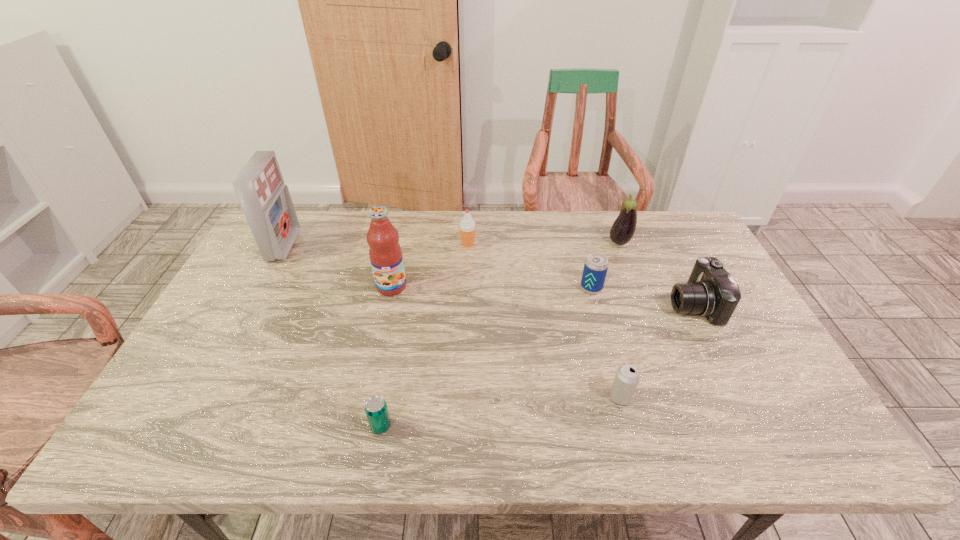
You are a GUI agent. You are given a task and a screenshot of the screen. Output one action in this format:
    pyautogui.click(x=<x>, y=<y>)
    Task: Click on the vacant space that satisfies the following two spatial constraints: 1. on the front side of the icecream; 2. on the right side of the second nearest object
    The width and height of the screenshot is (960, 540).
    Given the screenshot: What is the action you would take?
    pyautogui.click(x=463, y=397)

I want to click on vacant position in the image that satisfies the following two spatial constraints: 1. on the back side of the second nearest beer can; 2. on the right side of the eggplant, so click(578, 242).

Locate an element on the screen. Image resolution: width=960 pixels, height=540 pixels. vacant position in the image that satisfies the following two spatial constraints: 1. on the front label of the fruit juice; 2. on the right side of the farthest beer can is located at coordinates (391, 288).

Where is `free space that satisfies the following two spatial constraints: 1. on the back side of the farthest beer can; 2. on the right side of the sixth shortest object`? The height and width of the screenshot is (540, 960). free space that satisfies the following two spatial constraints: 1. on the back side of the farthest beer can; 2. on the right side of the sixth shortest object is located at coordinates (579, 242).

In order to click on blank area in the image that satisfies the following two spatial constraints: 1. on the front-facing side of the second nearest object; 2. on the right side of the leftmost object in this screenshot , I will do [204, 397].